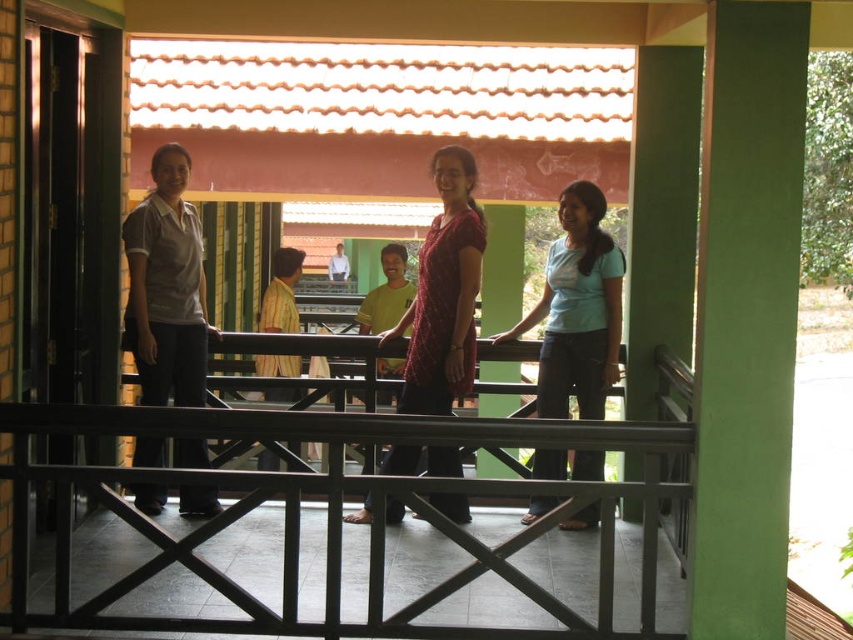
Which is more to the left, light blue fabric shirt at center or yellow matte shirt at center?

Positioned to the left is yellow matte shirt at center.

Locate an element on the screen. The width and height of the screenshot is (853, 640). light blue fabric shirt at center is located at coordinates (577, 308).

Locate an element on the screen. The image size is (853, 640). light blue fabric shirt at center is located at coordinates (577, 308).

Can you confirm if maroon textured dress at center is taller than yellow matte shirt at center?

Yes, maroon textured dress at center is taller than yellow matte shirt at center.

Is point (450, 276) closer to viewer compared to point (389, 364)?

Yes.

Does point (419, 285) come closer to viewer compared to point (369, 330)?

Yes, point (419, 285) is closer to viewer.

This screenshot has height=640, width=853. I want to click on maroon textured dress at center, so click(444, 292).

Between matte gray shirt at left and yellow matte shirt at center, which one is positioned lower?

Positioned lower is matte gray shirt at left.

Between matte gray shirt at left and yellow matte shirt at center, which one appears on the left side from the viewer's perspective?

From the viewer's perspective, matte gray shirt at left appears more on the left side.

Between point (171, 349) and point (380, 401), which one is positioned in front?

Positioned in front is point (171, 349).

Find the location of a particular element. matte gray shirt at left is located at coordinates (166, 285).